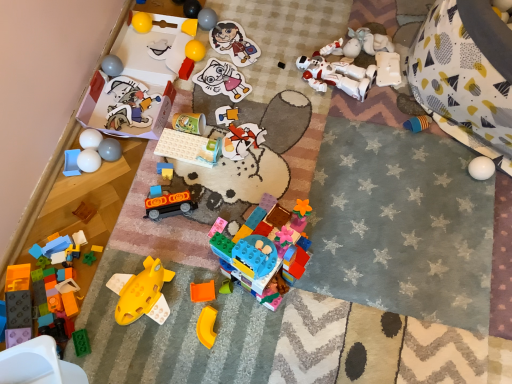
Question: Is translucent orange plastic at center, arranged as the nineteenth toy when viewed from the left, in front of or behind wooden block at lower left, the 3th toy from the left, in the image?

Choices:
 (A) front
 (B) behind

Answer: (A)

Question: Would you say translucent orange plastic at center, arranged as the nineteenth toy when viewed from the left, is to the left or to the right of wooden block at lower left, placed as the 21th toy when sorted from right to left, in the picture?

Choices:
 (A) left
 (B) right

Answer: (B)

Question: Which is farther from the smooth yellow ball at upper center, which is the 15th toy from left to right?

Choices:
 (A) white glossy ball at left, the nineteenth toy in the right-to-left sequence
 (B) matte gray ball at upper left, the seventeenth toy in the right-to-left sequence
 (C) translucent blue plastic blocks at lower left, the first toy from the left
 (D) glossy plastic ball at upper left, which appears as the eighteenth toy when viewed from the right
 (E) translucent orange plastic at center, the fifth toy in the right-to-left sequence

Answer: (E)

Question: Which of these objects is positioned closest to the matte plastic sticker at upper center, which is the 20th toy from left to right?

Choices:
 (A) smooth yellow ball at upper center, the ninth toy from the right
 (B) wooden block at lower left, the 3th toy from the left
 (C) matte plastic blocks at center, the 9th toy viewed from the left
 (D) matte gray ball at upper left, the seventeenth toy in the right-to-left sequence
 (E) white glossy balls at left, the 20th toy positioned from the right

Answer: (A)